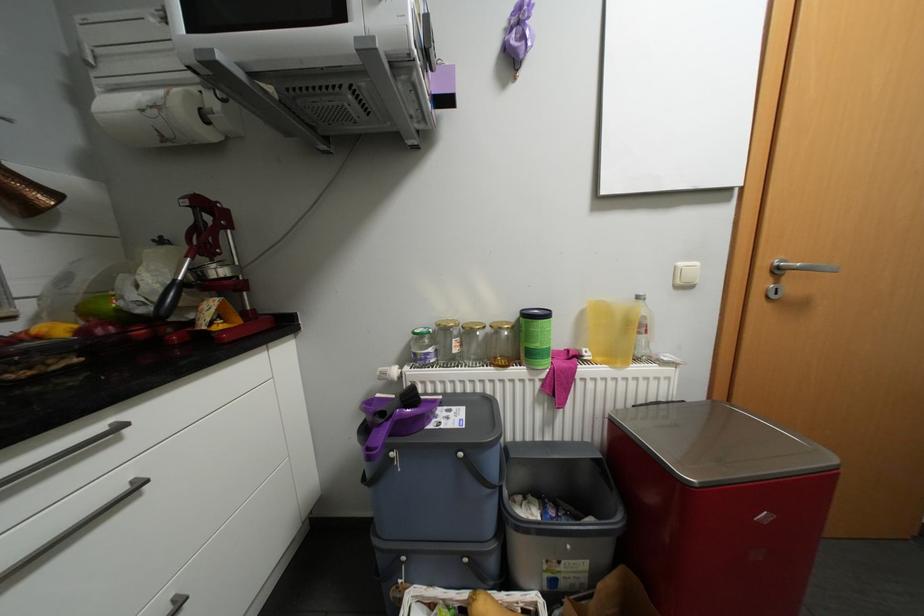
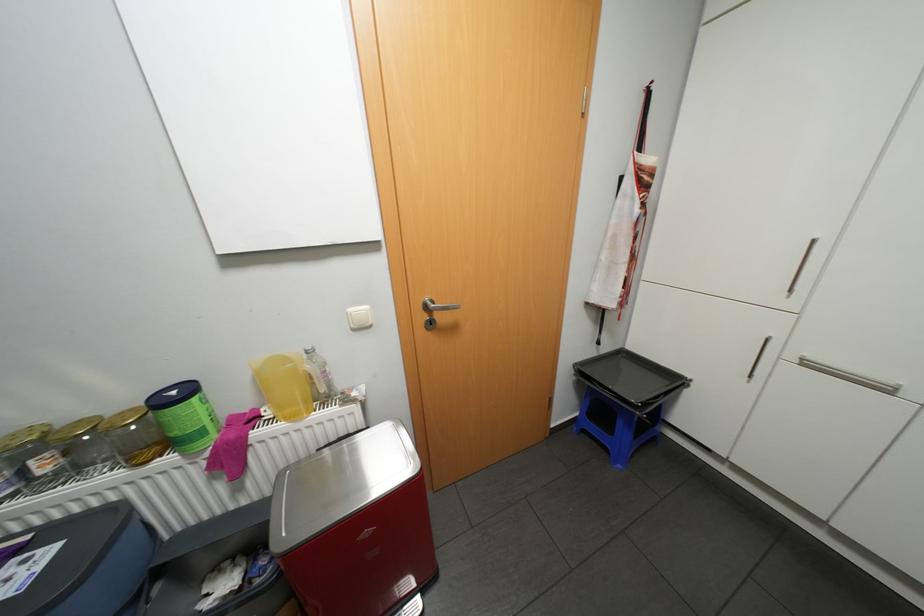
Locate, in the second image, the point that corresponds to (594,354) in the first image.

(275, 413)